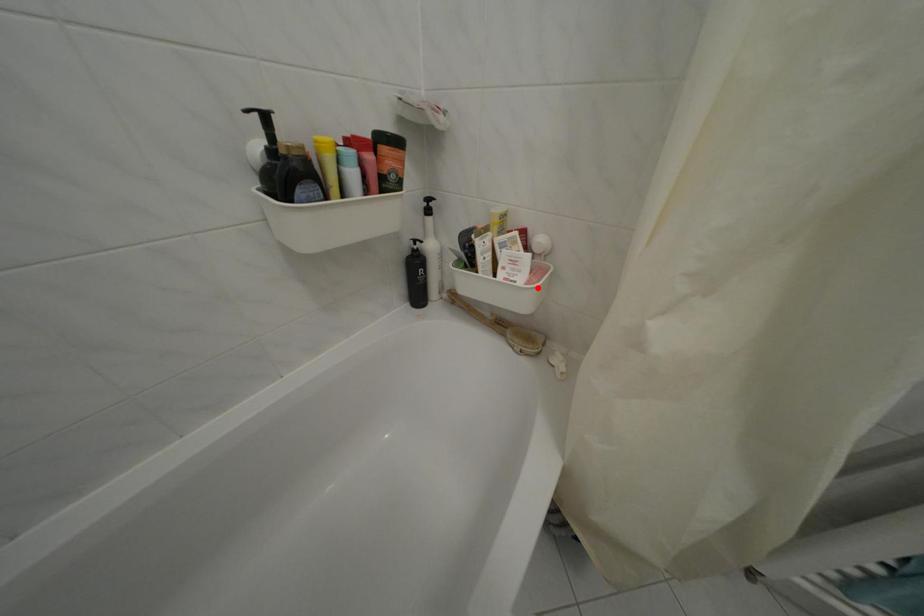
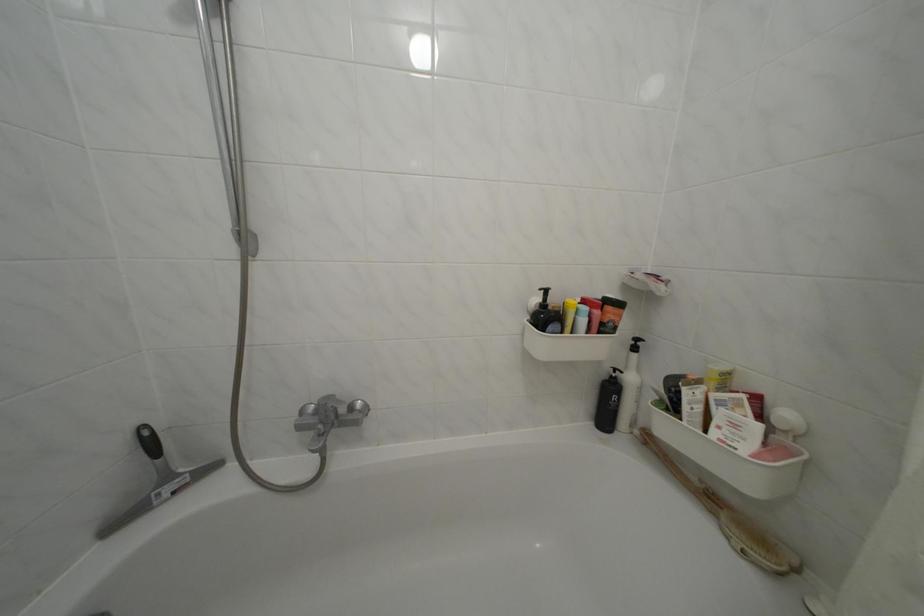
In the second image, find the point that corresponds to the highlighted location in the first image.

(766, 462)